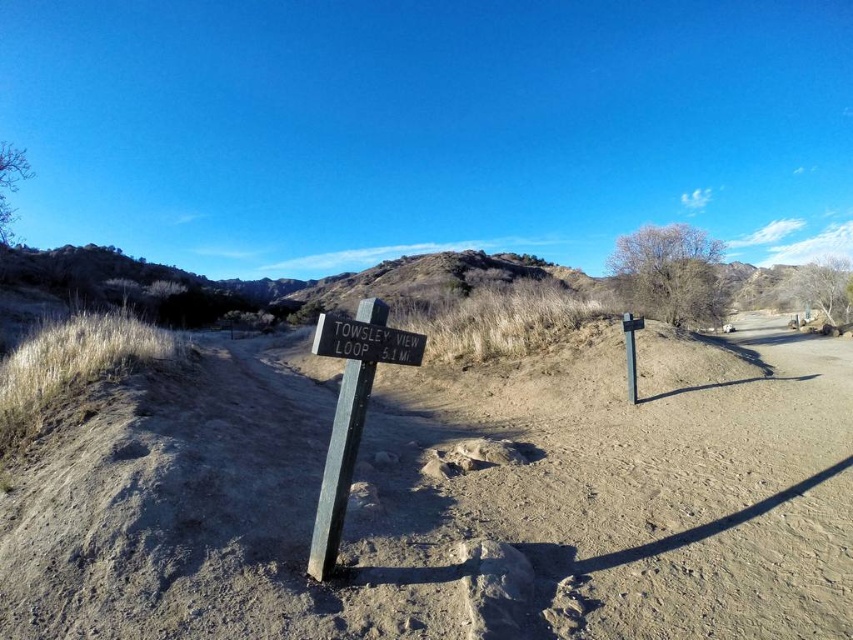
How much distance is there between brown sandy dirt track at center and wooden signpost at center?

They are 85.35 meters apart.

Does point (842, 544) come closer to viewer compared to point (340, 465)?

Yes, point (842, 544) is in front of point (340, 465).

Where is `brown sandy dirt track at center`? The height and width of the screenshot is (640, 853). brown sandy dirt track at center is located at coordinates (450, 500).

Between point (270, 380) and point (421, 362), which one is positioned behind?

Point (270, 380)

Is point (373, 518) less distant than point (402, 356)?

No, it is behind (402, 356).

This screenshot has width=853, height=640. I want to click on brown sandy dirt track at center, so (450, 500).

Find the location of a particular element. This screenshot has width=853, height=640. brown sandy dirt track at center is located at coordinates 450,500.

Can you confirm if wooden signpost at center is positioned above wooden sign at center?

No.

Is point (328, 556) in front of point (341, 348)?

Yes, point (328, 556) is in front of point (341, 348).

What do you see at coordinates (351, 412) in the screenshot? I see `wooden signpost at center` at bounding box center [351, 412].

What are the coordinates of `wooden signpost at center` in the screenshot? It's located at (351, 412).